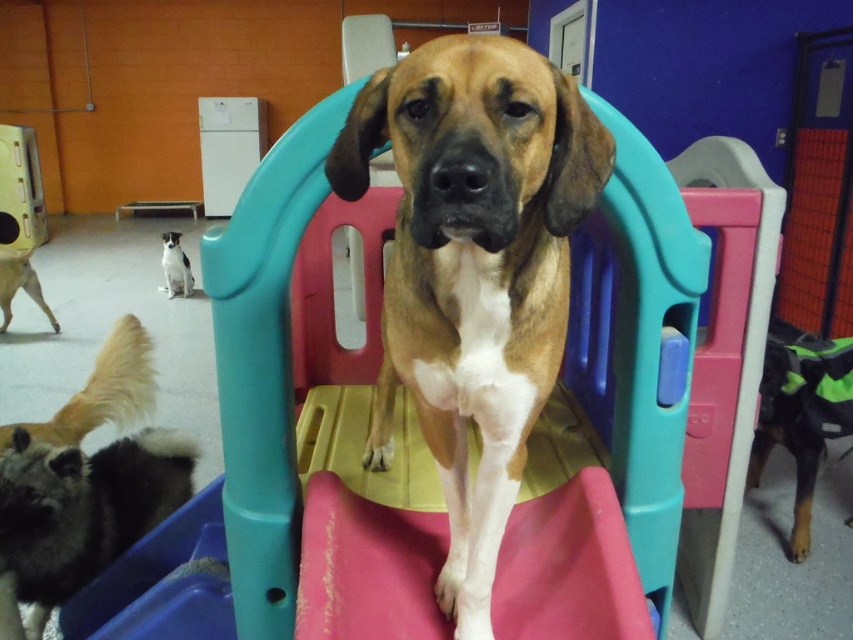
Question: Is brown matte dog at center wider than fluffy gray dog at lower left?

Choices:
 (A) yes
 (B) no

Answer: (B)

Question: Based on their relative distances, which object is nearer to the black and green fabric dog at lower right?

Choices:
 (A) brown matte dog at center
 (B) white fur at center
 (C) golden fur dog at lower left
 (D) fluffy gray dog at lower left

Answer: (A)

Question: Considering the real-world distances, which object is farthest from the white fur at center?

Choices:
 (A) black and green fabric dog at lower right
 (B) brown matte dog at center

Answer: (B)

Question: Does brown matte dog at center appear over fluffy gray dog at lower left?

Choices:
 (A) no
 (B) yes

Answer: (B)

Question: Which point is closer to the camera?

Choices:
 (A) golden fur dog at lower left
 (B) black and green fabric dog at lower right
 (C) brown matte dog at center

Answer: (C)

Question: Does brown matte dog at center appear under fluffy gray dog at lower left?

Choices:
 (A) yes
 (B) no

Answer: (B)